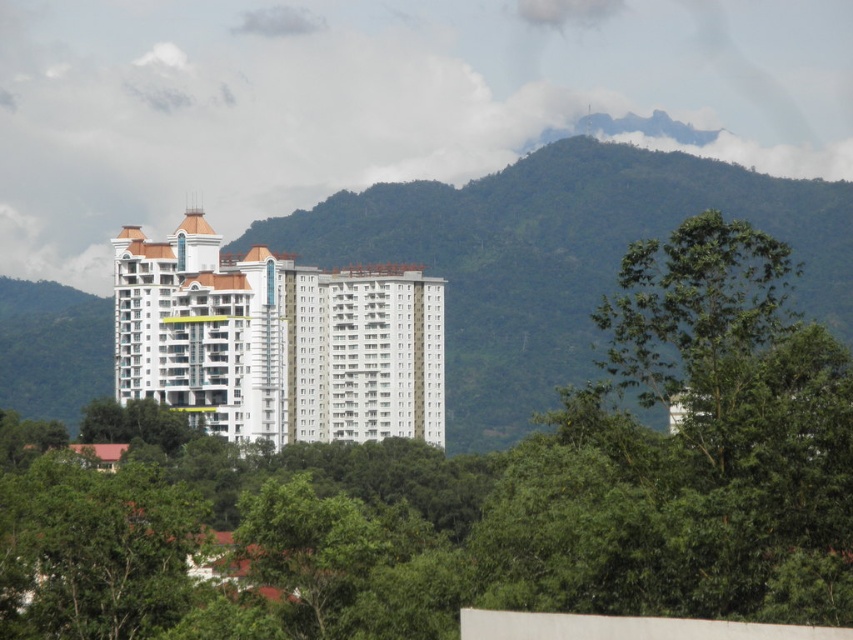
Is green leafy mountain at upper center positioned at the back of green leafy tree at center-right?

Yes.

What do you see at coordinates (556, 257) in the screenshot? This screenshot has height=640, width=853. I see `green leafy mountain at upper center` at bounding box center [556, 257].

I want to click on green leafy mountain at upper center, so click(x=556, y=257).

Who is lower down, green leafy tree at center or green leafy tree at center-right?

green leafy tree at center is below.

Does green leafy tree at center have a lesser width compared to green leafy tree at center-right?

No.

Find the location of a particular element. green leafy tree at center is located at coordinates (460, 472).

I want to click on green leafy tree at center, so click(x=460, y=472).

Can you confirm if green leafy tree at center is taller than green leafy mountain at upper center?

Indeed, green leafy tree at center has a greater height compared to green leafy mountain at upper center.

Based on the photo, between green leafy tree at center and green leafy mountain at upper center, which one appears on the left side from the viewer's perspective?

green leafy tree at center is more to the left.

The height and width of the screenshot is (640, 853). In order to click on green leafy tree at center in this screenshot , I will do `click(460, 472)`.